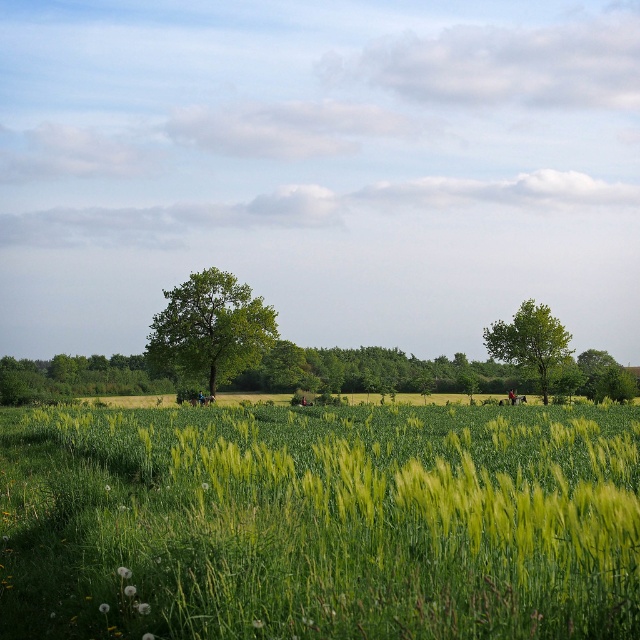
Does green leafy tree at center have a larger size compared to green leafy tree at right?

Correct, green leafy tree at center is larger in size than green leafy tree at right.

In the scene shown: Is green leafy tree at center behind green leafy tree at right?

No, green leafy tree at center is in front of green leafy tree at right.

Who is more distant from viewer, (221, 307) or (547, 312)?

The point (547, 312) is behind.

The image size is (640, 640). Find the location of `green leafy tree at center`. green leafy tree at center is located at coordinates (211, 326).

Between green grassy wheat field at center and green leafy tree at right, which one has less height?

green leafy tree at right

Does green grassy wheat field at center have a greater height compared to green leafy tree at right?

Yes, green grassy wheat field at center is taller than green leafy tree at right.

Is point (492, 529) positioned after point (515, 364)?

No, (492, 529) is closer to viewer.

This screenshot has height=640, width=640. I want to click on green grassy wheat field at center, so click(320, 522).

Is point (637, 428) positioned behind point (240, 323)?

That is False.

Does green grassy wheat field at center have a larger size compared to green leafy tree at center?

Correct, green grassy wheat field at center is larger in size than green leafy tree at center.

Who is more distant from viewer, (40, 628) or (176, 372)?

Positioned behind is point (176, 372).

The width and height of the screenshot is (640, 640). I want to click on green grassy wheat field at center, so click(x=320, y=522).